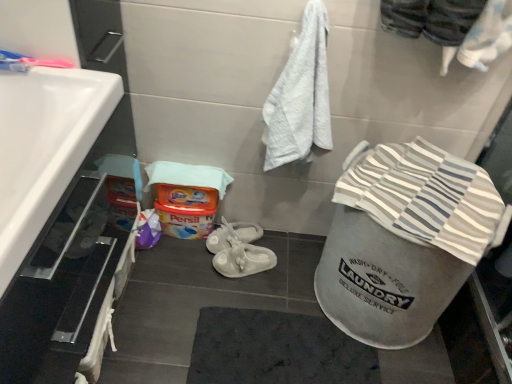
Measure the distance between point (217, 257) and camera.

The distance of point (217, 257) from camera is 1.68 meters.

At what (x,y) coordinates should I click in order to perform the action: click on striped cotton beach towel at lower right. Please return your answer as a coordinate pair (x, y). Looking at the image, I should click on (425, 197).

Find the location of `white glossy sink at left`. white glossy sink at left is located at coordinates (44, 147).

Does point (27, 139) lie in front of point (255, 262)?

Yes, it is in front of point (255, 262).

Are white glossy sink at left and white rubber sandals at center far apart?

Actually, white glossy sink at left and white rubber sandals at center are a little close together.

From the picture: Can you confirm if white glossy sink at left is shorter than white rubber sandals at center?

Incorrect, the height of white glossy sink at left does not fall short of that of white rubber sandals at center.

From a real-world perspective, is white glossy sink at left located higher than white rubber sandals at center?

Yes, from a real-world perspective, white glossy sink at left is on top of white rubber sandals at center.

Does white glossy sink at left appear on the right side of striped cotton beach towel at lower right?

No, white glossy sink at left is not to the right of striped cotton beach towel at lower right.

Is white glossy sink at left smaller than striped cotton beach towel at lower right?

Incorrect, white glossy sink at left is not smaller in size than striped cotton beach towel at lower right.

Who is shorter, white glossy sink at left or striped cotton beach towel at lower right?

striped cotton beach towel at lower right.

Is point (6, 94) closer to camera compared to point (410, 194)?

That is True.

In terms of size, does white rubber sandals at center appear bigger or smaller than white glossy sink at left?

In the image, white rubber sandals at center appears to be smaller than white glossy sink at left.

Between white rubber sandals at center and white glossy sink at left, which one has more height?

With more height is white glossy sink at left.

Would you say white glossy sink at left is part of white rubber sandals at center's contents?

Actually, white glossy sink at left is outside white rubber sandals at center.

The height and width of the screenshot is (384, 512). I want to click on beach towel that is above the white rubber sandals at center (from the image's perspective), so click(x=425, y=197).

From a real-world perspective, is white rubber sandals at center above or below striped cotton beach towel at lower right?

white rubber sandals at center is situated lower than striped cotton beach towel at lower right in the real world.

How different are the orientations of white rubber sandals at center and striped cotton beach towel at lower right in degrees?

The angular difference between white rubber sandals at center and striped cotton beach towel at lower right is 31.7 degrees.

Is white rubber sandals at center situated inside striped cotton beach towel at lower right or outside?

white rubber sandals at center cannot be found inside striped cotton beach towel at lower right.

From a real-world perspective, is striped cotton beach towel at lower right physically below white glossy sink at left?

→ Indeed, from a real-world perspective, striped cotton beach towel at lower right is positioned beneath white glossy sink at left.

Can you confirm if striped cotton beach towel at lower right is positioned to the left of white glossy sink at left?

Incorrect, striped cotton beach towel at lower right is not on the left side of white glossy sink at left.

Does striped cotton beach towel at lower right have a greater width compared to white glossy sink at left?

Yes, striped cotton beach towel at lower right is wider than white glossy sink at left.

Find the location of a particular element. beach towel that is under the white glossy sink at left (from a real-world perspective) is located at coordinates [x=425, y=197].

Is point (447, 180) positioned in front of point (221, 266)?

Yes, it is in front of point (221, 266).

At what (x,y) coordinates should I click in order to perform the action: click on footwear below the striped cotton beach towel at lower right (from the image's perspective). Please return your answer as a coordinate pair (x, y). Looking at the image, I should click on (243, 260).

Who is shorter, striped cotton beach towel at lower right or white rubber sandals at center?

With less height is striped cotton beach towel at lower right.

Image resolution: width=512 pixels, height=384 pixels. In order to click on sink lying on the left of white rubber sandals at center in this screenshot , I will do `click(44, 147)`.

Identify the location of beach towel behind the white glossy sink at left. (425, 197).

Based on their spatial positions, is white glossy sink at left or striped cotton beach towel at lower right further from white rubber sandals at center?

white glossy sink at left is further to white rubber sandals at center.

Looking at the image, which one is located further to striped cotton beach towel at lower right, white glossy sink at left or white rubber sandals at center?

The object further to striped cotton beach towel at lower right is white glossy sink at left.

When comparing their distances from striped cotton beach towel at lower right, does white rubber sandals at center or white glossy sink at left seem closer?

white rubber sandals at center lies closer to striped cotton beach towel at lower right than the other object.

When comparing their distances from white glossy sink at left, does white rubber sandals at center or striped cotton beach towel at lower right seem closer?

striped cotton beach towel at lower right is closer to white glossy sink at left.

Estimate the real-world distances between objects in this image. Which object is further from white rubber sandals at center, striped cotton beach towel at lower right or white glossy sink at left?

white glossy sink at left is further to white rubber sandals at center.

Looking at the image, which one is located further to white glossy sink at left, striped cotton beach towel at lower right or white rubber sandals at center?

Among the two, white rubber sandals at center is located further to white glossy sink at left.

I want to click on footwear between white glossy sink at left and striped cotton beach towel at lower right, so click(243, 260).